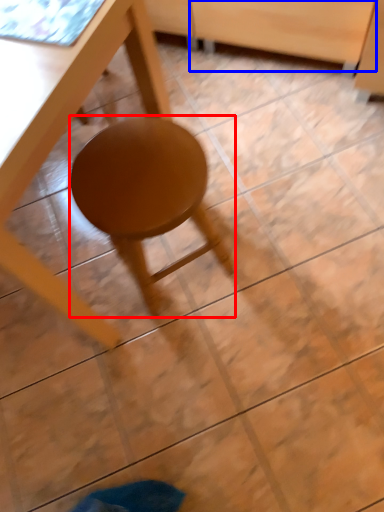
Question: Which point is further to the camera, stool (highlighted by a red box) or drawer (highlighted by a blue box)?

Choices:
 (A) stool
 (B) drawer

Answer: (B)